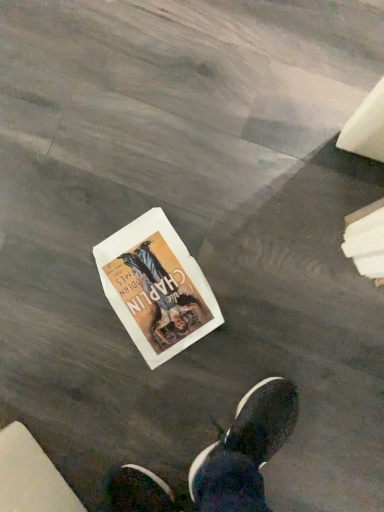
The height and width of the screenshot is (512, 384). Find the location of `free location in front of white paper at center`. free location in front of white paper at center is located at coordinates (208, 376).